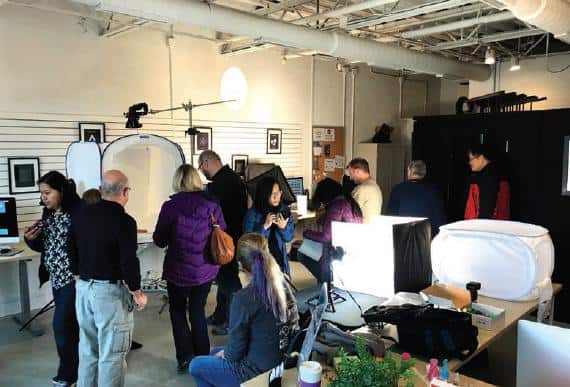
Identify the location of pictures. (28, 173), (85, 133), (202, 134), (239, 161), (276, 131).